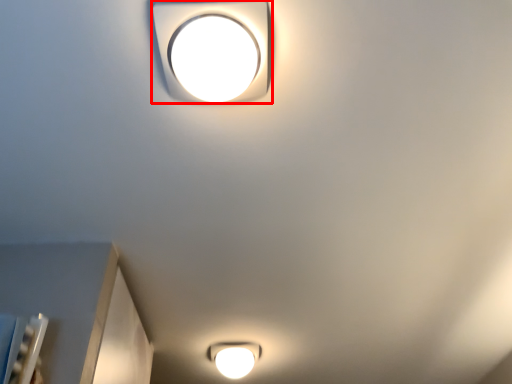
Question: Considering the relative positions of lamp (annotated by the red box) and lamp in the image provided, where is lamp (annotated by the red box) located with respect to the staircase?

Choices:
 (A) left
 (B) right

Answer: (B)